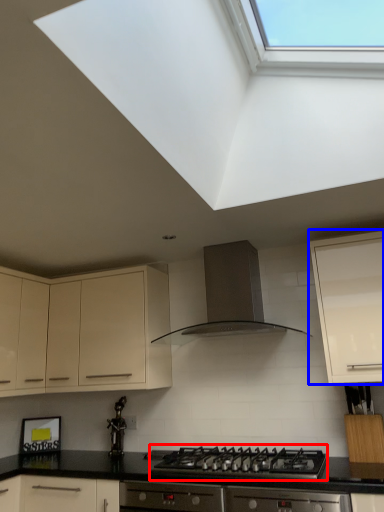
Question: Which object is further to the camera taking this photo, gas stove (highlighted by a red box) or cabinetry (highlighted by a blue box)?

Choices:
 (A) gas stove
 (B) cabinetry

Answer: (B)